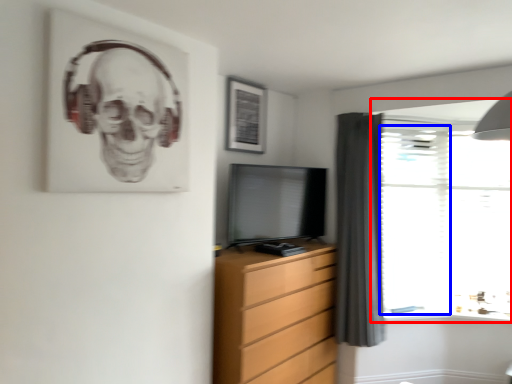
Question: Which object appears farthest to the camera in this image, window (highlighted by a red box) or glass door (highlighted by a blue box)?

Choices:
 (A) window
 (B) glass door

Answer: (B)